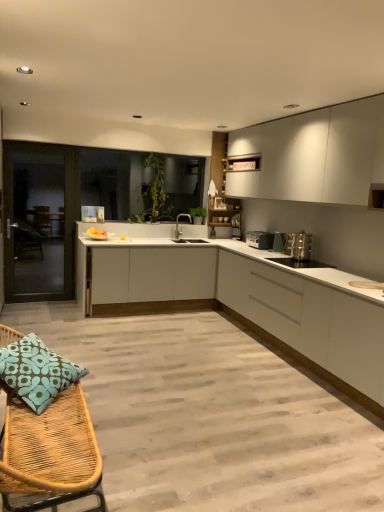
Question: Is white matte cabinet at center, placed as the 2th cabinetry when sorted from top to bottom, taller than satin silver toaster at right, which ranks as the second appliance in front-to-back order?

Choices:
 (A) yes
 (B) no

Answer: (A)

Question: From the image's perspective, is white matte cabinet at center, placed as the 2th cabinetry when sorted from top to bottom, located beneath satin silver toaster at right, which ranks as the second appliance in front-to-back order?

Choices:
 (A) no
 (B) yes

Answer: (B)

Question: Is white matte cabinet at center, placed as the 2th cabinetry when sorted from top to bottom, in front of satin silver toaster at right, which ranks as the second appliance in front-to-back order?

Choices:
 (A) no
 (B) yes

Answer: (A)

Question: Can you confirm if white matte cabinet at center, the 2th cabinetry when ordered from bottom to top, is positioned to the right of satin silver toaster at right, which ranks as the second appliance in front-to-back order?

Choices:
 (A) no
 (B) yes

Answer: (A)

Question: Considering the relative positions of white matte cabinet at center, the 2th cabinetry when ordered from bottom to top, and satin silver toaster at right, which appears as the 2th appliance when viewed from the back, in the image provided, is white matte cabinet at center, the 2th cabinetry when ordered from bottom to top, to the left of satin silver toaster at right, which appears as the 2th appliance when viewed from the back, from the viewer's perspective?

Choices:
 (A) no
 (B) yes

Answer: (B)

Question: Can you confirm if white matte cabinet at center, the 2th cabinetry when ordered from bottom to top, is wider than satin silver toaster at right, which ranks as the second appliance in front-to-back order?

Choices:
 (A) no
 (B) yes

Answer: (B)

Question: Is white matte cabinet at upper right, marked as the 3th cabinetry in a bottom-to-top arrangement, at the left side of satin silver toaster at right, which ranks as the second appliance in front-to-back order?

Choices:
 (A) no
 (B) yes

Answer: (A)

Question: Does white matte cabinet at upper right, which is counted as the 1th cabinetry, starting from the top, have a greater width compared to satin silver toaster at right, which appears as the 2th appliance when viewed from the back?

Choices:
 (A) yes
 (B) no

Answer: (A)

Question: Is white matte cabinet at upper right, marked as the 3th cabinetry in a bottom-to-top arrangement, bigger than satin silver toaster at right, which ranks as the second appliance in front-to-back order?

Choices:
 (A) no
 (B) yes

Answer: (B)

Question: Is white matte cabinet at upper right, marked as the 3th cabinetry in a bottom-to-top arrangement, positioned behind satin silver toaster at right, which appears as the 2th appliance when viewed from the back?

Choices:
 (A) no
 (B) yes

Answer: (A)

Question: Is white matte cabinet at upper right, marked as the 3th cabinetry in a bottom-to-top arrangement, shorter than satin silver toaster at right, which appears as the 2th appliance when viewed from the back?

Choices:
 (A) yes
 (B) no

Answer: (B)

Question: From the image's perspective, is white matte cabinet at upper right, which is counted as the 1th cabinetry, starting from the top, beneath satin silver toaster at right, which appears as the 2th appliance when viewed from the back?

Choices:
 (A) yes
 (B) no

Answer: (B)

Question: From the image's perspective, is satin nickel faucet at center over white matte cabinet at right, arranged as the 1th cabinetry when ordered from the bottom?

Choices:
 (A) no
 (B) yes

Answer: (B)